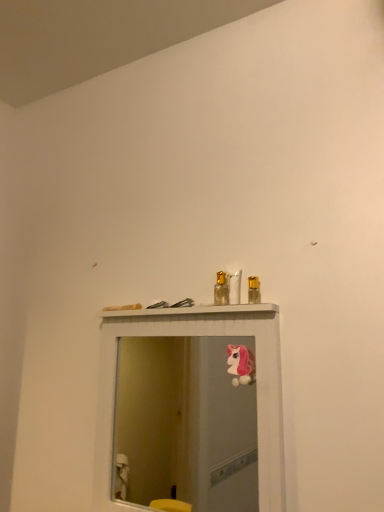
Question: Can you confirm if metallic gold spray can at upper center, which is the 1th toiletry in right-to-left order, is positioned to the right of gold metallic perfume bottle at center, the 2th toiletry in the right-to-left sequence?

Choices:
 (A) yes
 (B) no

Answer: (A)

Question: Considering the relative sizes of metallic gold spray can at upper center, which is the 1th toiletry in right-to-left order, and gold metallic perfume bottle at center, the 2th toiletry in the right-to-left sequence, in the image provided, is metallic gold spray can at upper center, which is the 1th toiletry in right-to-left order, smaller than gold metallic perfume bottle at center, the 2th toiletry in the right-to-left sequence,?

Choices:
 (A) no
 (B) yes

Answer: (B)

Question: Is metallic gold spray can at upper center, positioned as the 2th toiletry in left-to-right order, beside gold metallic perfume bottle at center, the 2th toiletry in the right-to-left sequence?

Choices:
 (A) no
 (B) yes

Answer: (B)

Question: Is metallic gold spray can at upper center, which is the 1th toiletry in right-to-left order, positioned with its back to gold metallic perfume bottle at center, arranged as the first toiletry when viewed from the left?

Choices:
 (A) yes
 (B) no

Answer: (B)

Question: From a real-world perspective, is metallic gold spray can at upper center, positioned as the 2th toiletry in left-to-right order, positioned under gold metallic perfume bottle at center, arranged as the first toiletry when viewed from the left, based on gravity?

Choices:
 (A) yes
 (B) no

Answer: (A)

Question: From the image's perspective, is metallic gold spray can at upper center, positioned as the 2th toiletry in left-to-right order, located beneath gold metallic perfume bottle at center, the 2th toiletry in the right-to-left sequence?

Choices:
 (A) no
 (B) yes

Answer: (B)

Question: Does pink plush unicorn at upper center have a greater width compared to metallic gold spray can at upper center, positioned as the 2th toiletry in left-to-right order?

Choices:
 (A) no
 (B) yes

Answer: (B)

Question: Can metallic gold spray can at upper center, positioned as the 2th toiletry in left-to-right order, be found inside pink plush unicorn at upper center?

Choices:
 (A) no
 (B) yes

Answer: (A)

Question: Does pink plush unicorn at upper center have a larger size compared to metallic gold spray can at upper center, which is the 1th toiletry in right-to-left order?

Choices:
 (A) no
 (B) yes

Answer: (B)

Question: From a real-world perspective, does pink plush unicorn at upper center sit lower than metallic gold spray can at upper center, positioned as the 2th toiletry in left-to-right order?

Choices:
 (A) yes
 (B) no

Answer: (A)

Question: Is pink plush unicorn at upper center to the left of metallic gold spray can at upper center, positioned as the 2th toiletry in left-to-right order, from the viewer's perspective?

Choices:
 (A) yes
 (B) no

Answer: (A)

Question: Considering the relative positions of pink plush unicorn at upper center and metallic gold spray can at upper center, positioned as the 2th toiletry in left-to-right order, in the image provided, is pink plush unicorn at upper center behind metallic gold spray can at upper center, positioned as the 2th toiletry in left-to-right order,?

Choices:
 (A) no
 (B) yes

Answer: (A)

Question: Considering the relative positions of metallic gold spray can at upper center, which is the 1th toiletry in right-to-left order, and pink plush unicorn at upper center in the image provided, is metallic gold spray can at upper center, which is the 1th toiletry in right-to-left order, in front of pink plush unicorn at upper center?

Choices:
 (A) no
 (B) yes

Answer: (A)